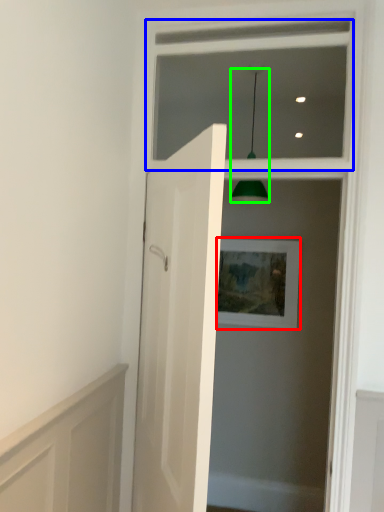
Question: Based on their relative distances, which object is nearer to picture frame (highlighted by a red box)? Choose from window frame (highlighted by a blue box) and light fixture (highlighted by a green box).

Choices:
 (A) window frame
 (B) light fixture

Answer: (B)